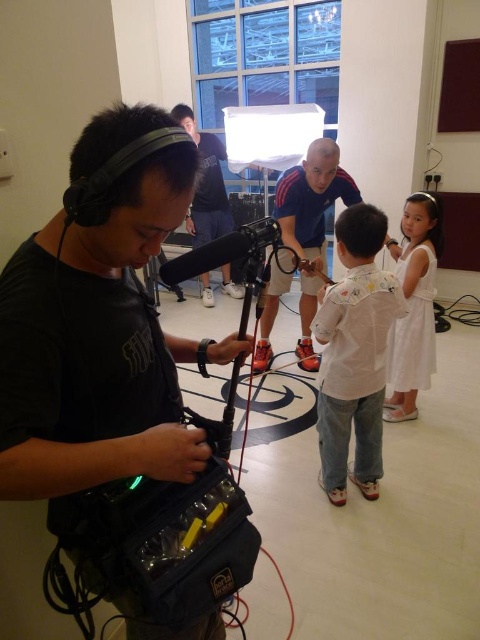
Question: Can you confirm if reddish-brown leather jacket at center is positioned to the left of matte black microphone at center?

Choices:
 (A) yes
 (B) no

Answer: (A)

Question: Which is nearer to the matte black microphone at center?

Choices:
 (A) white cotton shirt at center
 (B) white cotton dress at right
 (C) reddish-brown leather jacket at center

Answer: (C)

Question: Which point is farther to the camera?

Choices:
 (A) [x=205, y=182]
 (B) [x=300, y=268]
 (C) [x=418, y=301]

Answer: (A)

Question: Is black matte headphones at left smaller than white cotton shirt at center?

Choices:
 (A) yes
 (B) no

Answer: (B)

Question: Is white cotton shirt at center to the left of smooth beige shirt at center from the viewer's perspective?

Choices:
 (A) yes
 (B) no

Answer: (B)

Question: Which point appears farthest from the camera in this image?

Choices:
 (A) (372, 230)
 (B) (195, 196)
 (C) (319, 147)

Answer: (B)